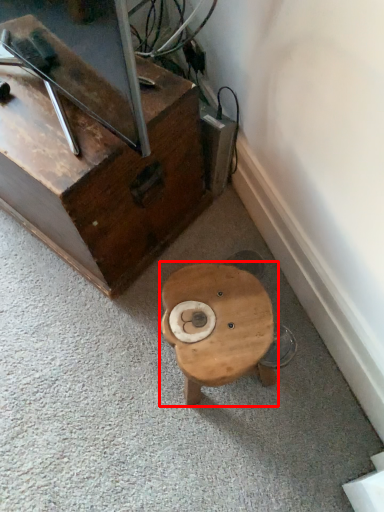
Question: From the image's perspective, what is the correct spatial relationship of table (annotated by the red box) in relation to furniture?

Choices:
 (A) below
 (B) above

Answer: (A)